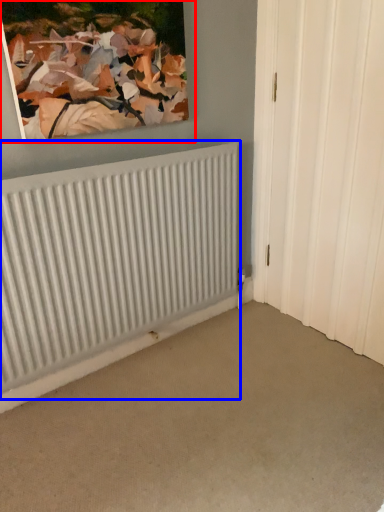
Question: Which object appears closest to the camera in this image, picture frame (highlighted by a red box) or radiator (highlighted by a blue box)?

Choices:
 (A) picture frame
 (B) radiator

Answer: (A)